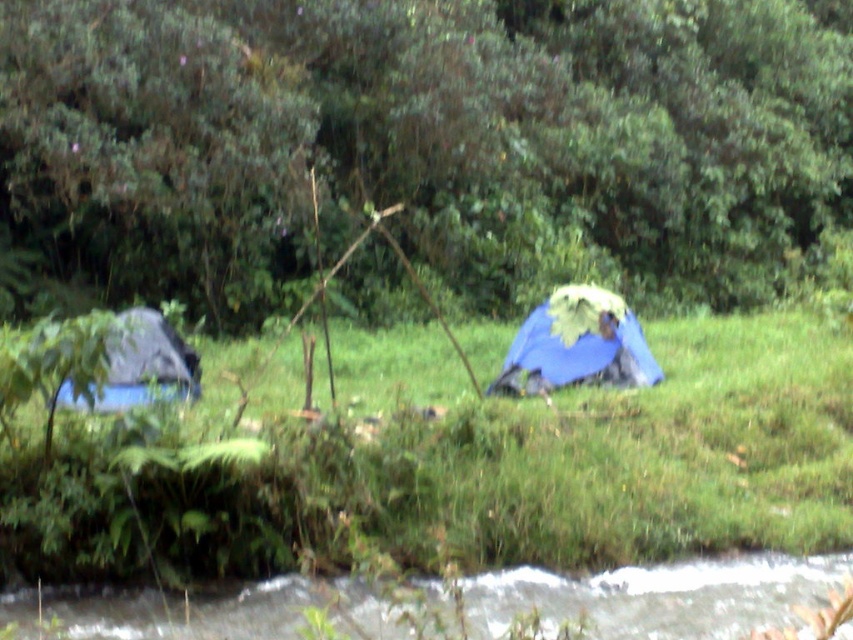
Question: From the image, what is the correct spatial relationship of green grass at lower center in relation to blue fabric tent at left?

Choices:
 (A) right
 (B) left

Answer: (A)

Question: Which of the following is the farthest from the observer?

Choices:
 (A) (165, 364)
 (B) (656, 630)

Answer: (A)

Question: Which object is farther from the camera taking this photo?

Choices:
 (A) blue fabric tent at center
 (B) blue fabric tent at left
 (C) green leafy tree at upper center
 (D) white frothy water at lower center

Answer: (C)

Question: Can you confirm if white frothy water at lower center is positioned to the right of blue fabric tent at center?

Choices:
 (A) yes
 (B) no

Answer: (B)

Question: Which object appears closest to the camera in this image?

Choices:
 (A) blue fabric tent at left
 (B) blue fabric tent at center

Answer: (A)

Question: Observing the image, what is the correct spatial positioning of green grass at lower center in reference to white frothy water at lower center?

Choices:
 (A) left
 (B) right

Answer: (A)